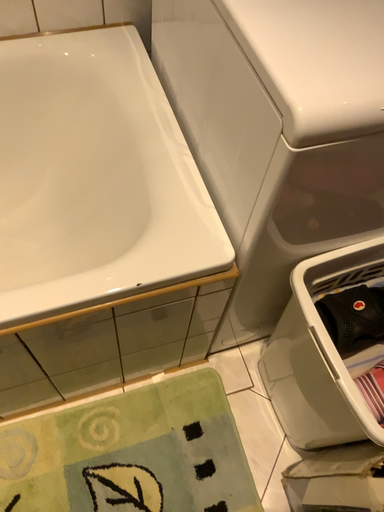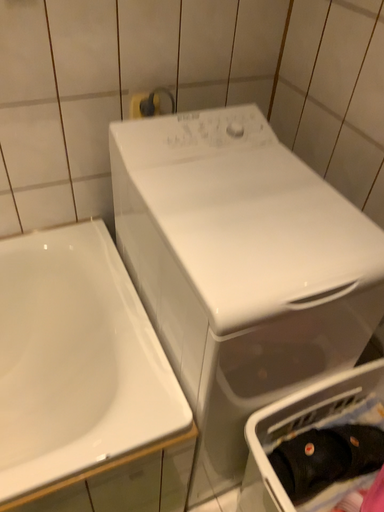
Question: How did the camera likely rotate when shooting the video?

Choices:
 (A) rotated downward
 (B) rotated upward

Answer: (B)